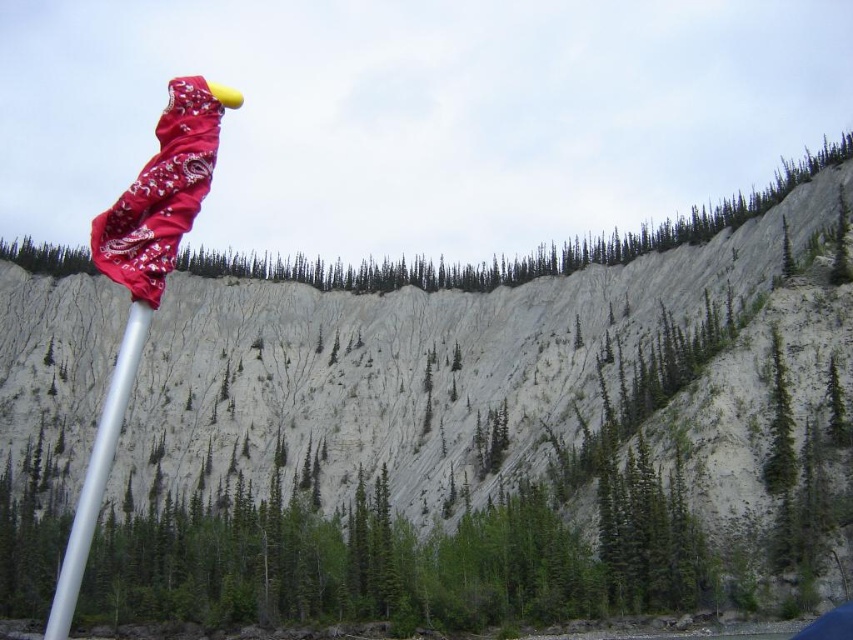
You are a hiker standing at the base of the cliff and see the silver metallic pole at left and the green textured tree at center. Which object is closer to your current position?

The silver metallic pole at left is closer to your current position because it is positioned below the green textured tree at center, indicating it is nearer in the foreground.